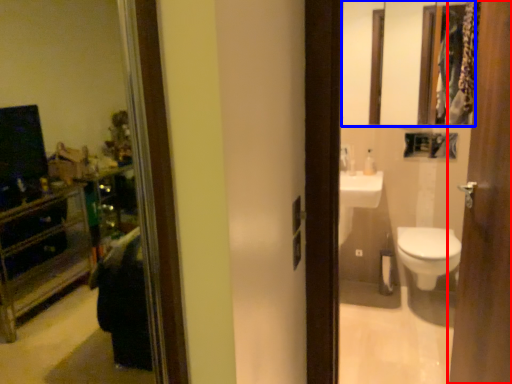
Question: Among these objects, which one is nearest to the camera, door (highlighted by a red box) or mirror (highlighted by a blue box)?

Choices:
 (A) door
 (B) mirror

Answer: (A)